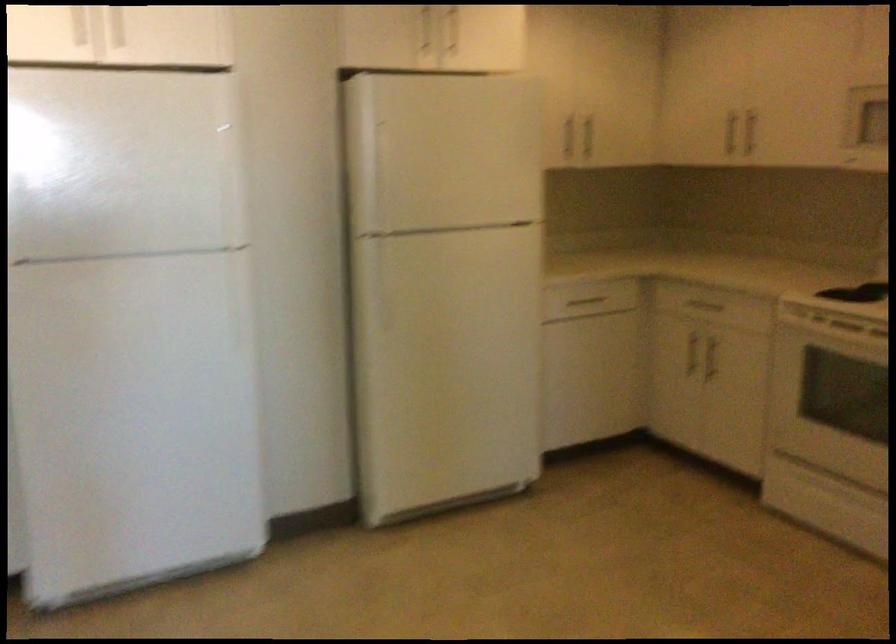
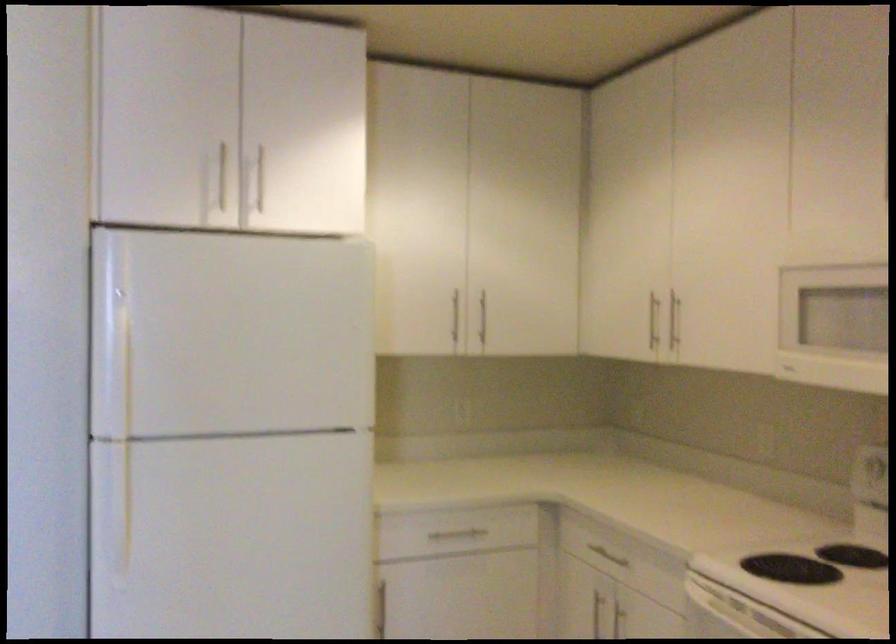
The point at (x=367, y=162) is marked in the first image. Where is the corresponding point in the second image?

(113, 346)